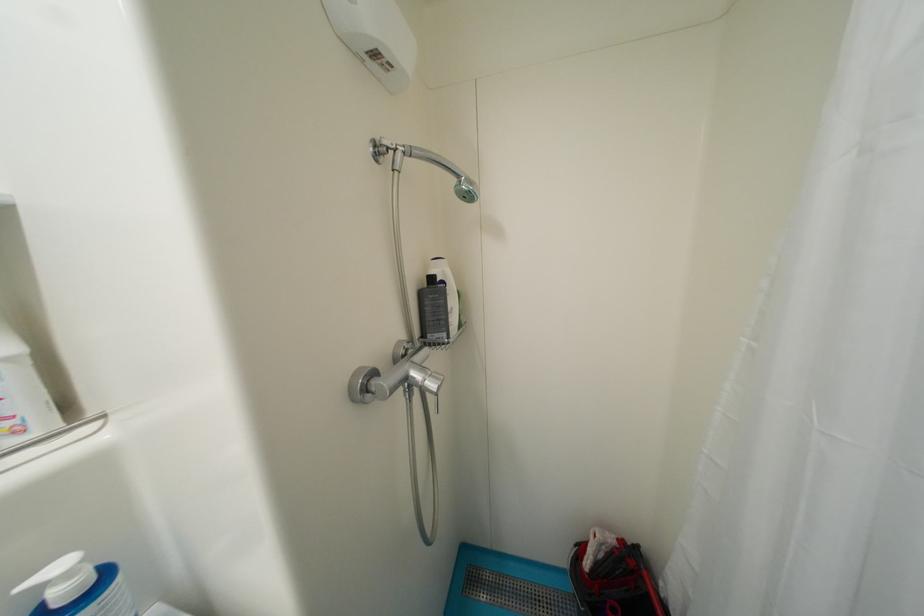
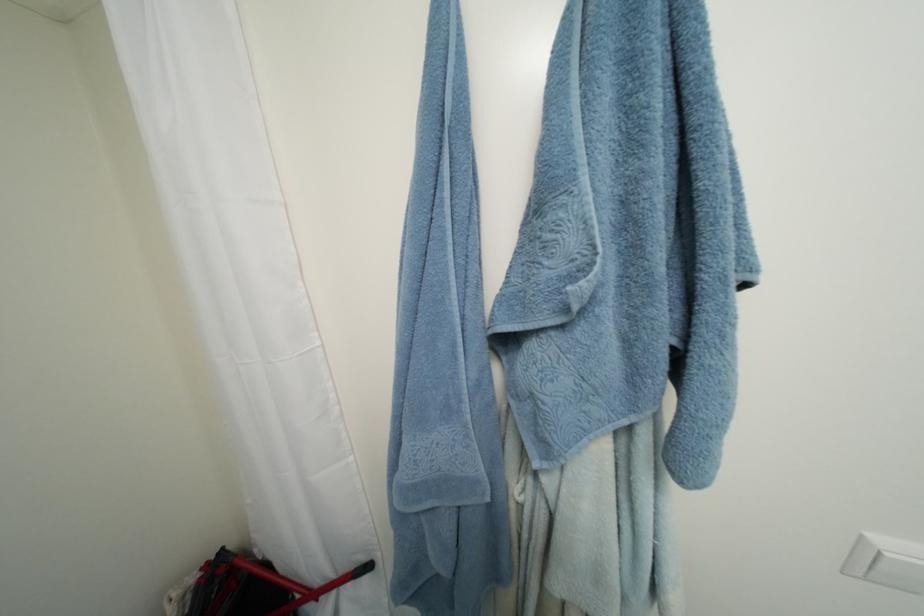
Question: The camera is either moving clockwise (left) or counter-clockwise (right) around the object. The first image is from the beginning of the video and the second image is from the end. Is the camera moving left or right when shooting the video?

Choices:
 (A) Left
 (B) Right

Answer: (A)